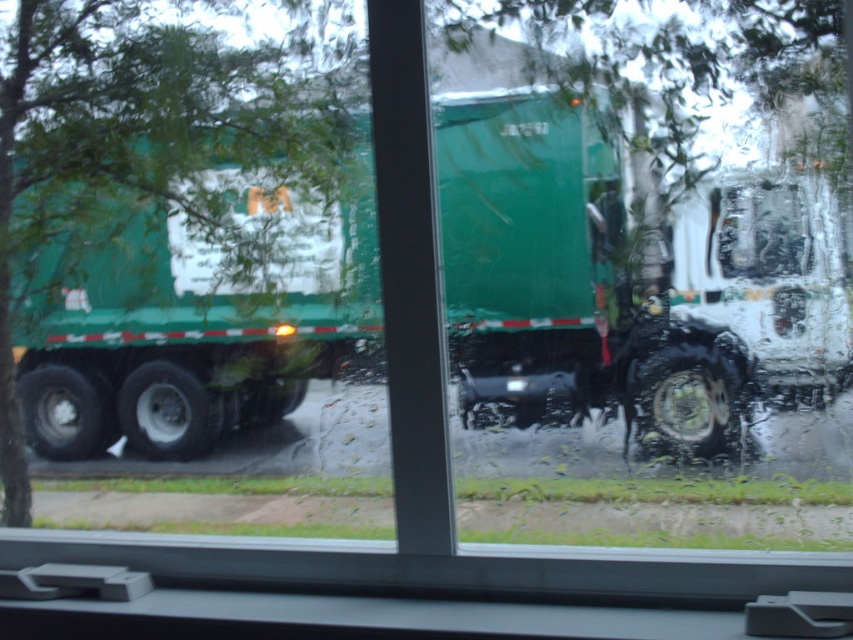
You are a delivery person who needs to park your van between the green leafy tree at left and the shiny metallic truck at center. The van is 10 feet long. Can you fit your van between them?

The distance between the green leafy tree at left and the shiny metallic truck at center is 37.02 inches, which is approximately 3.08 feet. Since the van is 10 feet long, it cannot fit between them.

You are a delivery driver who needs to park your van between the green leafy tree at left and the shiny metallic truck at center. Can you fit your van there?

The green leafy tree at left might be wider than shiny metallic truck at center, so the space between them may not be wide enough for your van.